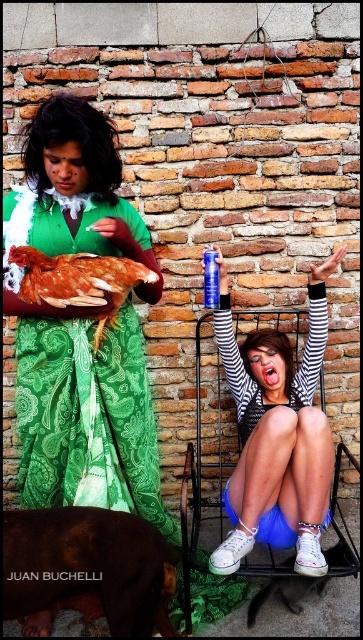
Question: From the image, what is the correct spatial relationship of green paisley dress at left in relation to striped fabric dress at center?

Choices:
 (A) left
 (B) right

Answer: (A)

Question: Is striped fabric dress at center wider than brown feathered chicken at center?

Choices:
 (A) no
 (B) yes

Answer: (B)

Question: Which point is farther to the camera?

Choices:
 (A) (316, 282)
 (B) (128, 504)
 (C) (49, 264)

Answer: (A)

Question: Which point appears closest to the camera in this image?

Choices:
 (A) pos(31,260)
 (B) pos(136,500)

Answer: (A)

Question: Among these objects, which one is nearest to the camera?

Choices:
 (A) green paisley dress at left
 (B) striped fabric dress at center

Answer: (A)

Question: Does striped fabric dress at center appear on the left side of brown feathered chicken at center?

Choices:
 (A) yes
 (B) no

Answer: (B)